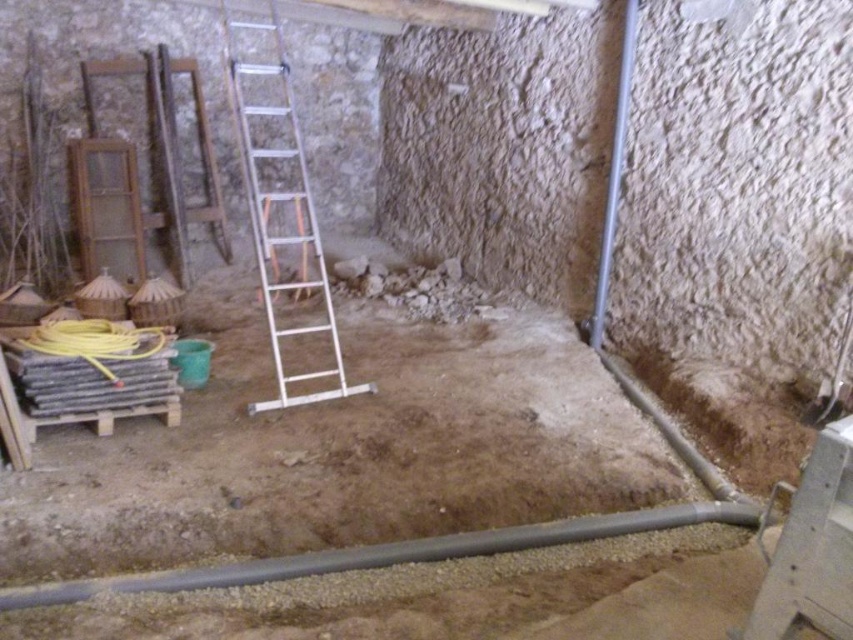
Question: Which of the following is the farthest from the observer?

Choices:
 (A) yellow rubber hose at lower left
 (B) metallic pipe at right
 (C) brown dirt at center

Answer: (B)

Question: Does silver metallic ladder at center appear on the right side of metallic pipe at right?

Choices:
 (A) no
 (B) yes

Answer: (A)

Question: Which point is closer to the camera?

Choices:
 (A) metallic pipe at right
 (B) gray rubber pipe at lower center

Answer: (B)

Question: In this image, where is gray rubber pipe at lower center located relative to yellow rubber hose at lower left?

Choices:
 (A) left
 (B) right

Answer: (B)

Question: Is gray rubber pipe at lower center closer to the viewer compared to yellow rubber hose at lower left?

Choices:
 (A) yes
 (B) no

Answer: (A)

Question: Which point is farther to the camera?

Choices:
 (A) gray rubber pipe at lower center
 (B) metallic pipe at right
 (C) brown dirt at center
 (D) yellow rubber hose at lower left

Answer: (B)